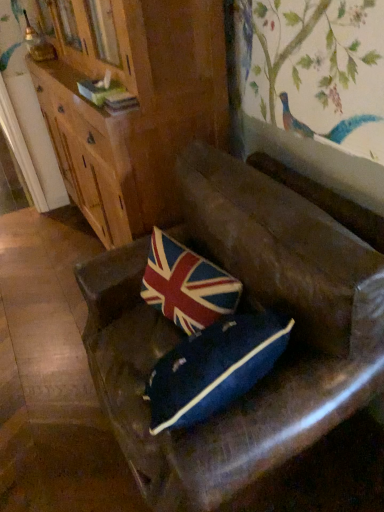
Question: Is union jack fabric pillow at center in front of or behind wooden cabinet at upper left in the image?

Choices:
 (A) behind
 (B) front

Answer: (B)

Question: Considering the positions of union jack fabric pillow at center and wooden cabinet at upper left in the image, is union jack fabric pillow at center wider or thinner than wooden cabinet at upper left?

Choices:
 (A) wide
 (B) thin

Answer: (B)

Question: Based on their relative distances, which object is nearer to the union jack fabric pillow at center?

Choices:
 (A) wooden cabinet at upper left
 (B) leather couch at center

Answer: (B)

Question: Based on their relative distances, which object is farther from the leather couch at center?

Choices:
 (A) wooden cabinet at upper left
 (B) union jack fabric pillow at center

Answer: (A)